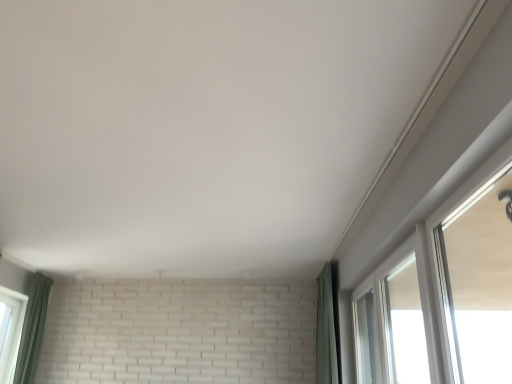
Question: Is point (420, 309) closer or farther from the camera than point (327, 370)?

Choices:
 (A) farther
 (B) closer

Answer: (A)

Question: Based on their sizes in the image, would you say transparent glass window at upper right, the first window in the back-to-front sequence, is bigger or smaller than green fabric curtain at right, the first curtain when ordered from right to left?

Choices:
 (A) small
 (B) big

Answer: (A)

Question: Which object is positioned farthest from the green fabric curtain at lower left, which is the second curtain in right-to-left order?

Choices:
 (A) white glossy window at upper right, placed as the 1th window when sorted from front to back
 (B) green fabric curtain at right, positioned as the 2th curtain in left-to-right order
 (C) transparent glass window at upper right, the first window in the back-to-front sequence

Answer: (C)

Question: Estimate the real-world distances between objects in this image. Which object is farther from the transparent glass window at upper right, the first window in the back-to-front sequence?

Choices:
 (A) white glossy window at upper right, placed as the 1th window when sorted from front to back
 (B) green fabric curtain at right, the first curtain when ordered from right to left
 (C) green fabric curtain at lower left, placed as the 1th curtain when sorted from left to right

Answer: (C)